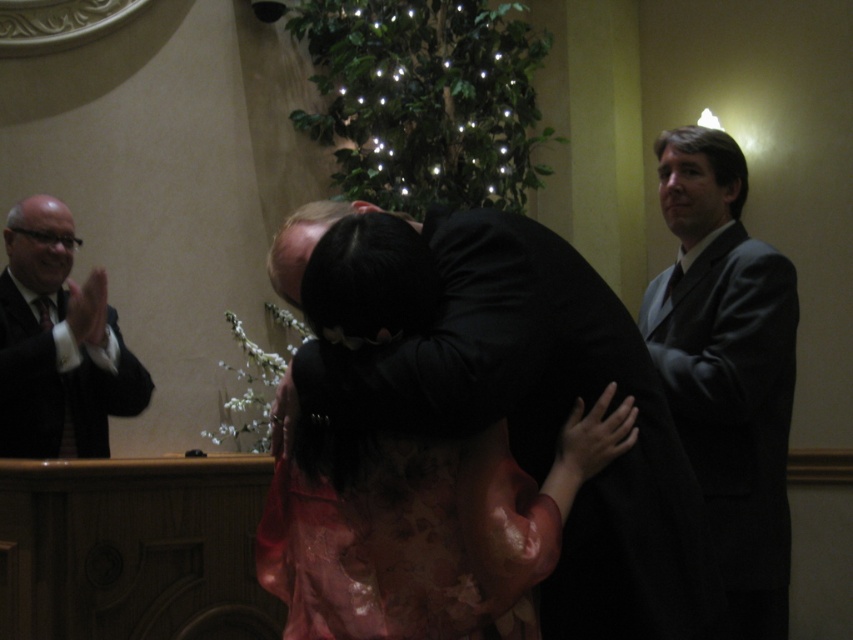
Can you confirm if floral lace dress at center is wider than black suit at left?

Yes.

What do you see at coordinates (471, 512) in the screenshot?
I see `floral lace dress at center` at bounding box center [471, 512].

The image size is (853, 640). I want to click on floral lace dress at center, so click(471, 512).

Is dark gray suit at right in front of floral lace dress at center?

That is False.

Does dark gray suit at right have a greater height compared to floral lace dress at center?

Yes, dark gray suit at right is taller than floral lace dress at center.

Is point (740, 481) positioned before point (376, 212)?

No, (740, 481) is behind (376, 212).

This screenshot has height=640, width=853. In order to click on dark gray suit at right in this screenshot , I will do `click(727, 369)`.

Is dark gray suit at right shorter than black suit at left?

Incorrect, dark gray suit at right's height does not fall short of black suit at left's.

The height and width of the screenshot is (640, 853). In order to click on dark gray suit at right in this screenshot , I will do `click(727, 369)`.